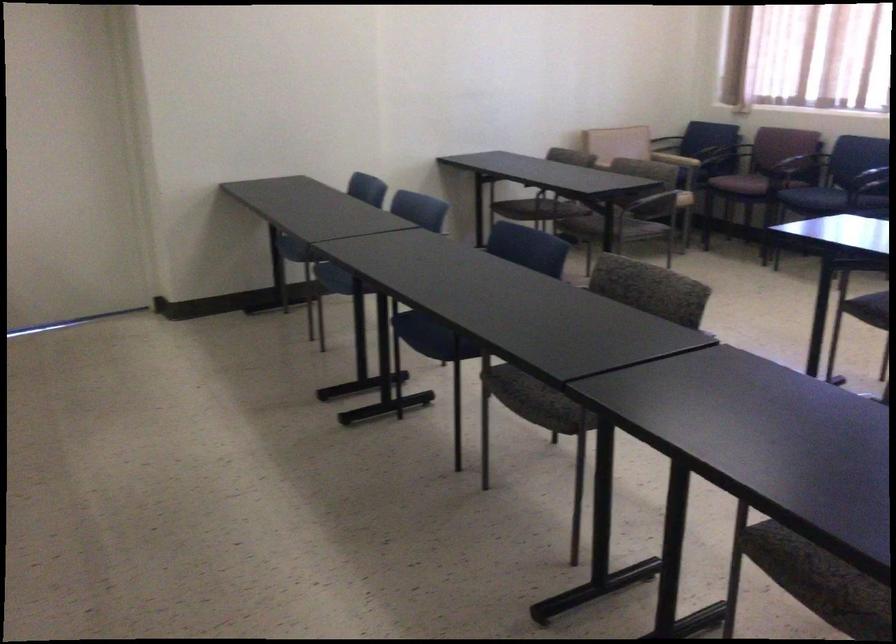
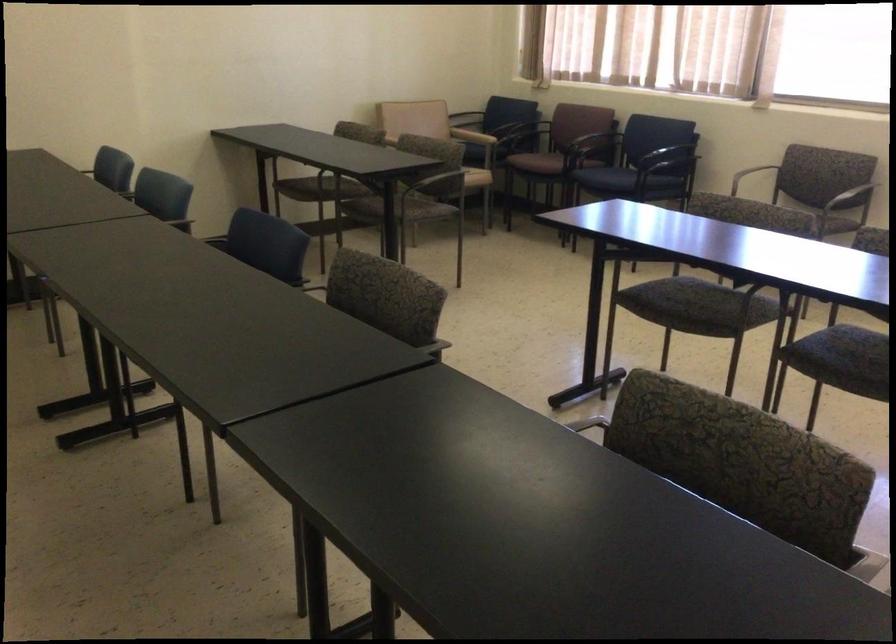
In a continuous first-person perspective shot, in which direction is the camera moving?

The cameraman moved toward right, forward.